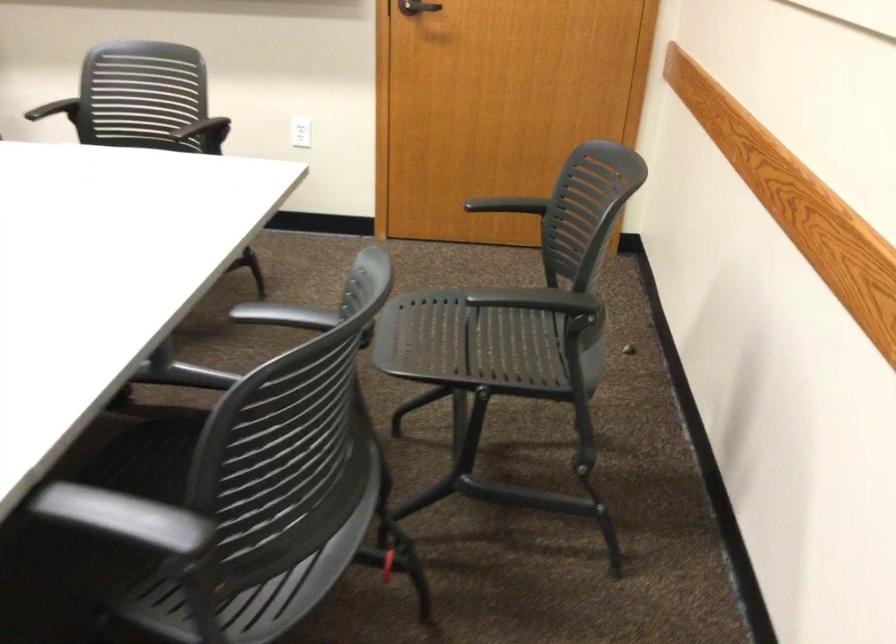
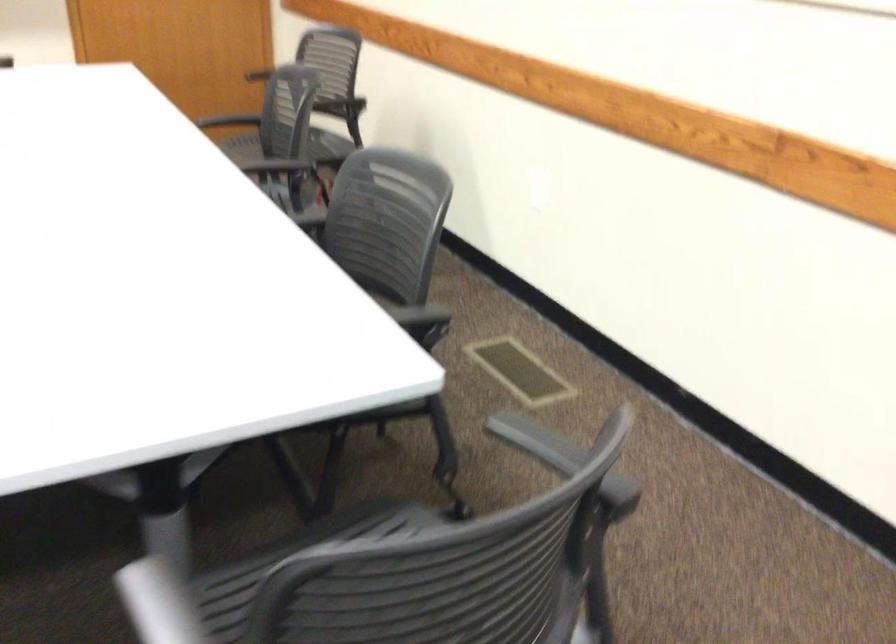
The point at (229, 453) is marked in the first image. Where is the corresponding point in the second image?

(294, 144)